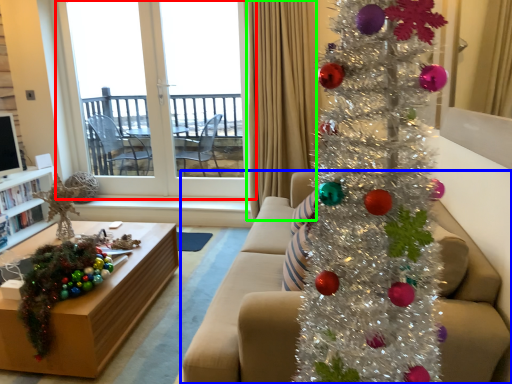
Question: Considering the real-world distances, which object is closest to window (highlighted by a red box)? studio couch (highlighted by a blue box) or curtain (highlighted by a green box).

Choices:
 (A) studio couch
 (B) curtain

Answer: (B)